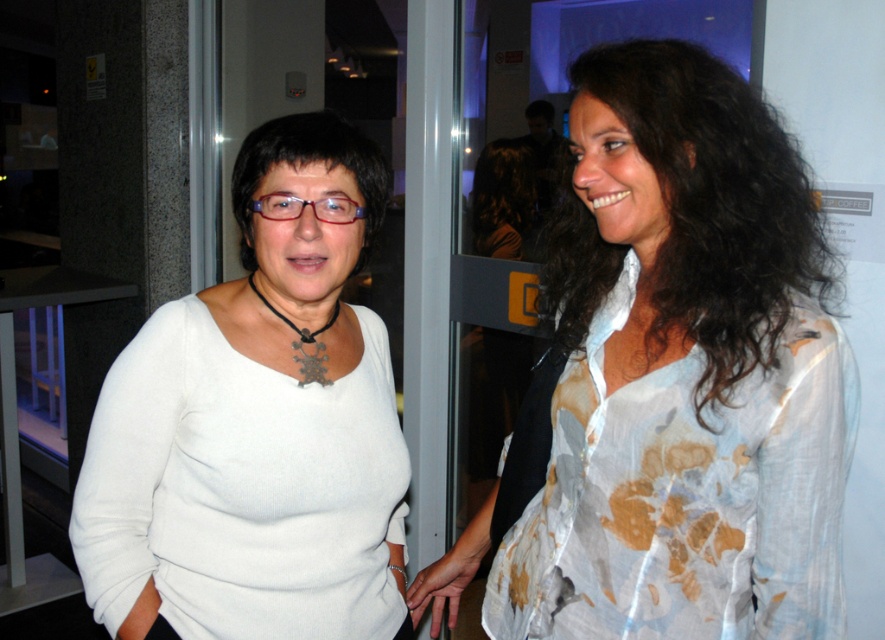
From the picture: You are at a networking event and need to introduce yourself to both people. Which person with black curly hair at upper right and black matte hair at center should you approach first if you want to greet the one closer to the entrance?

The black curly hair at upper right is below black matte hair at center, so the black matte hair at center is closer to the entrance. Approach the black matte hair at center first.

You are at a social event and want to find the white sheer blouse at right. According to the coordinates provided, where should you look?

The white sheer blouse at right is located at point (675, 380).

You are an interior designer assessing the layout of this event space. You notice the white sheer blouse at right and the black matte hair at center. Which object occupies a taller vertical space in the image?

The white sheer blouse at right has a greater height compared to the black matte hair at center, so it occupies more vertical space.